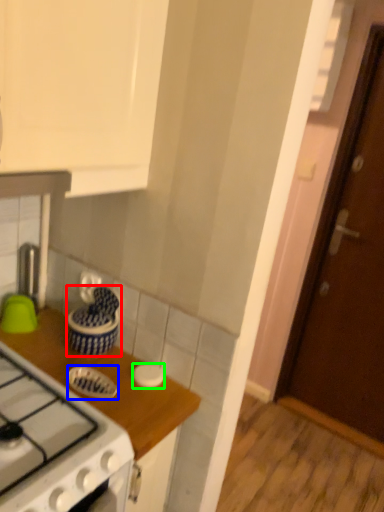
Question: Based on their relative distances, which object is farther from kitchen appliance (highlighted by a red box)? Choose from kitchen appliance (highlighted by a blue box) and kitchen appliance (highlighted by a green box).

Choices:
 (A) kitchen appliance
 (B) kitchen appliance

Answer: (B)